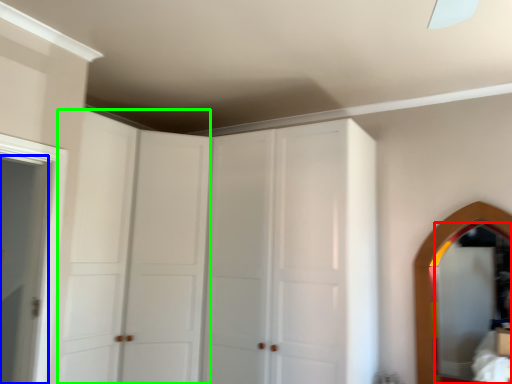
Question: Which is farther away from mirror (highlighted by a red box)? door (highlighted by a blue box) or glass door (highlighted by a green box)?

Choices:
 (A) door
 (B) glass door

Answer: (A)